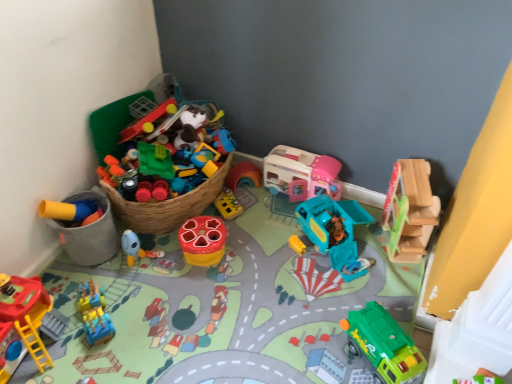
This screenshot has height=384, width=512. I want to click on vacant region to the left of green matte truck at lower right, arranged as the second toy when viewed from the right, so click(324, 350).